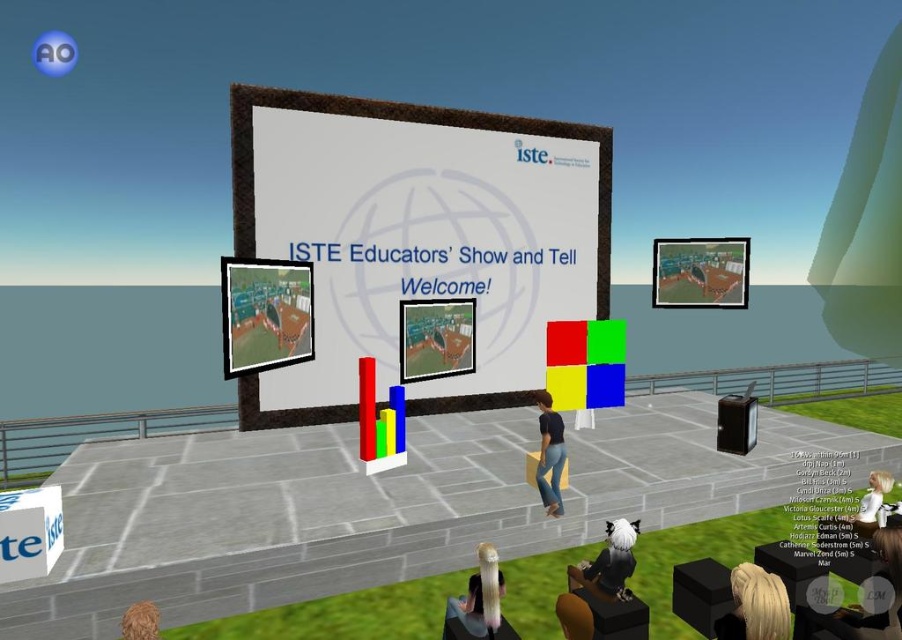
Does black hair at lower center appear under fluffy brown hair at lower left?

Yes, black hair at lower center is below fluffy brown hair at lower left.

In the scene shown: Is black hair at lower center taller than fluffy brown hair at lower left?

Correct, black hair at lower center is much taller as fluffy brown hair at lower left.

This screenshot has width=902, height=640. What do you see at coordinates (608, 563) in the screenshot?
I see `black hair at lower center` at bounding box center [608, 563].

Where is `black hair at lower center`? The image size is (902, 640). black hair at lower center is located at coordinates (608, 563).

Which is behind, point (695, 307) or point (492, 616)?

The point (695, 307) is behind.

Does matte plastic screen at upper center have a smaller size compared to blonde hair at lower center?

No, matte plastic screen at upper center is not smaller than blonde hair at lower center.

Where is `matte plastic screen at upper center`? The image size is (902, 640). matte plastic screen at upper center is located at coordinates (700, 273).

Find the location of a particular element. This screenshot has width=902, height=640. matte plastic screen at upper center is located at coordinates (700, 273).

Does blonde hair at lower center have a greater height compared to black matte shirt at center?

In fact, blonde hair at lower center may be shorter than black matte shirt at center.

Does blonde hair at lower center appear under black matte shirt at center?

Yes.

At what (x,y) coordinates should I click in order to perform the action: click on blonde hair at lower center. Please return your answer as a coordinate pair (x, y). This screenshot has height=640, width=902. Looking at the image, I should click on (483, 595).